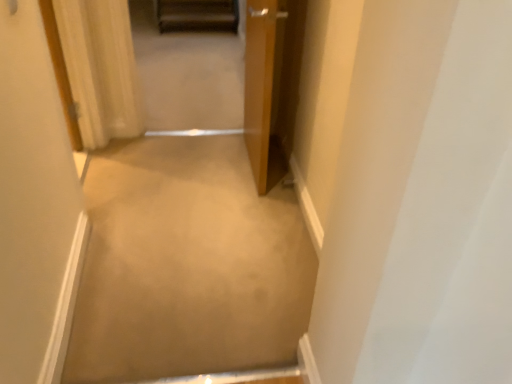
Question: Is wooden door at upper left not close to wooden door at center, positioned as the second door in left-to-right order?

Choices:
 (A) no
 (B) yes

Answer: (B)

Question: Does wooden door at upper left appear on the right side of wooden door at center, placed as the first door when sorted from right to left?

Choices:
 (A) no
 (B) yes

Answer: (A)

Question: Is wooden door at upper left at the left side of wooden door at center, placed as the first door when sorted from right to left?

Choices:
 (A) no
 (B) yes

Answer: (B)

Question: Is wooden door at upper left next to wooden door at center, positioned as the second door in left-to-right order, and touching it?

Choices:
 (A) yes
 (B) no

Answer: (B)

Question: From the image's perspective, is wooden door at upper left on wooden door at center, placed as the first door when sorted from right to left?

Choices:
 (A) no
 (B) yes

Answer: (B)

Question: Considering the relative sizes of wooden door at upper left and wooden door at center, placed as the first door when sorted from right to left, in the image provided, is wooden door at upper left bigger than wooden door at center, placed as the first door when sorted from right to left,?

Choices:
 (A) no
 (B) yes

Answer: (B)

Question: Is white wood door at left, placed as the first door when sorted from left to right, outside wooden door at upper left?

Choices:
 (A) yes
 (B) no

Answer: (A)

Question: From the image's perspective, is white wood door at left, which is counted as the 2th door, starting from the right, over wooden door at upper left?

Choices:
 (A) no
 (B) yes

Answer: (A)

Question: Considering the relative sizes of white wood door at left, placed as the first door when sorted from left to right, and wooden door at upper left in the image provided, is white wood door at left, placed as the first door when sorted from left to right, bigger than wooden door at upper left?

Choices:
 (A) no
 (B) yes

Answer: (B)

Question: Could you tell me if white wood door at left, placed as the first door when sorted from left to right, is turned towards wooden door at upper left?

Choices:
 (A) no
 (B) yes

Answer: (A)

Question: Does white wood door at left, which is counted as the 2th door, starting from the right, have a greater width compared to wooden door at upper left?

Choices:
 (A) yes
 (B) no

Answer: (B)

Question: Is white wood door at left, placed as the first door when sorted from left to right, positioned with its back to wooden door at upper left?

Choices:
 (A) no
 (B) yes

Answer: (A)

Question: Is beige carpet at center bigger than wooden door at upper left?

Choices:
 (A) no
 (B) yes

Answer: (A)